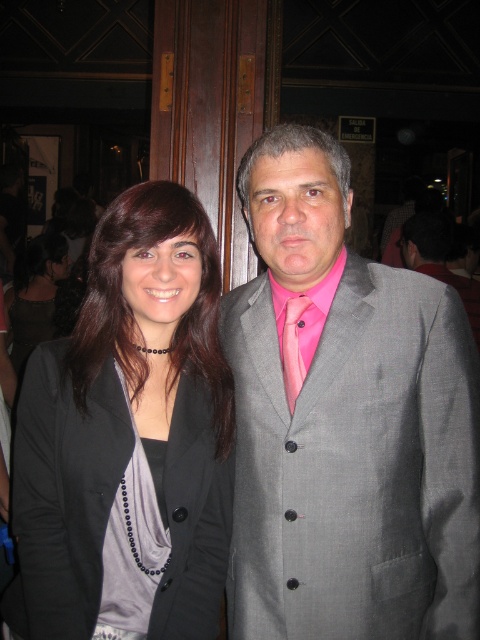
Question: Which point appears farthest from the camera in this image?

Choices:
 (A) (465, 296)
 (B) (289, 417)
 (C) (288, 392)
 (D) (182, 416)

Answer: (A)

Question: Does gray suit at center have a lesser width compared to pink satin tie at center?

Choices:
 (A) no
 (B) yes

Answer: (A)

Question: Does black matte blazer at center appear under gray suit at center?

Choices:
 (A) yes
 (B) no

Answer: (A)

Question: Is gray suit at center bigger than pink satin tie at center?

Choices:
 (A) no
 (B) yes

Answer: (B)

Question: Which point is farther to the camera?

Choices:
 (A) pink satin tie at center
 (B) matte gray suit at center

Answer: (A)

Question: Which object is farther from the camera taking this photo?

Choices:
 (A) matte gray suit at center
 (B) pink satin tie at center
 (C) gray suit at center

Answer: (C)